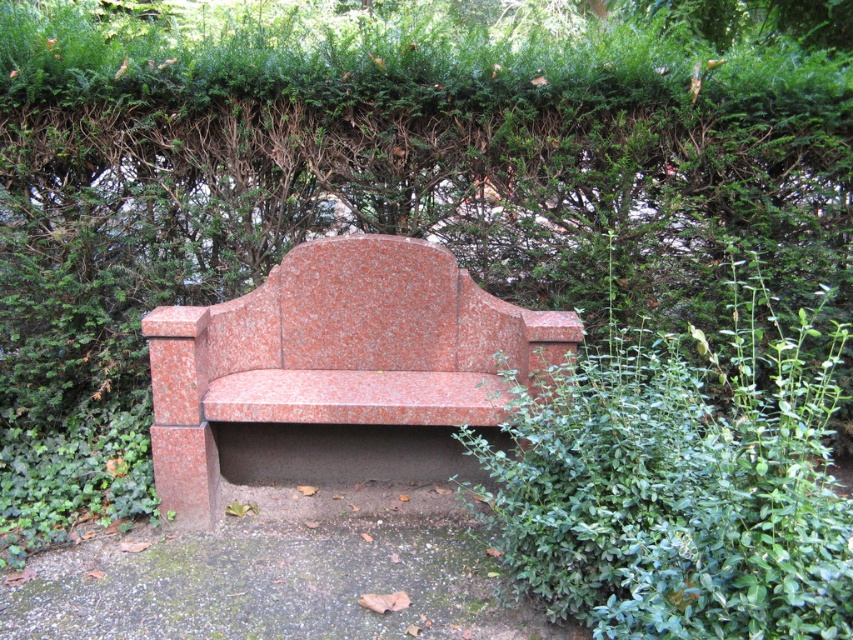
You are sitting on the granite bench at center and want to pick a leaf from the green leafy bush at lower right. Can you reach it without moving from the bench?

The green leafy bush at lower right is located below granite bench at center, so you can reach it without moving from the bench since it is positioned beneath you.